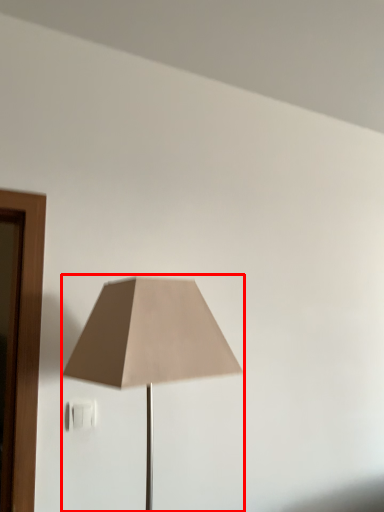
Question: In this image, where is lamp (annotated by the red box) located relative to electric outlet?

Choices:
 (A) left
 (B) right

Answer: (B)